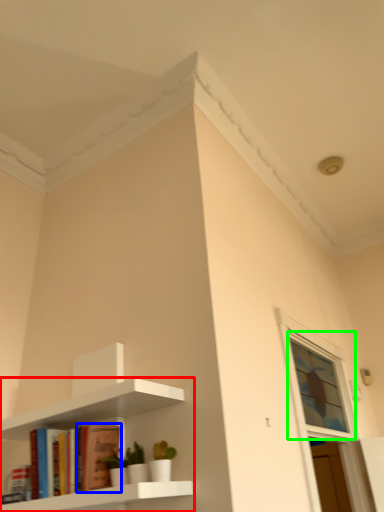
Question: Based on their relative distances, which object is farther from shelf (highlighted by a red box)? Choose from book (highlighted by a blue box) and window (highlighted by a green box).

Choices:
 (A) book
 (B) window

Answer: (B)